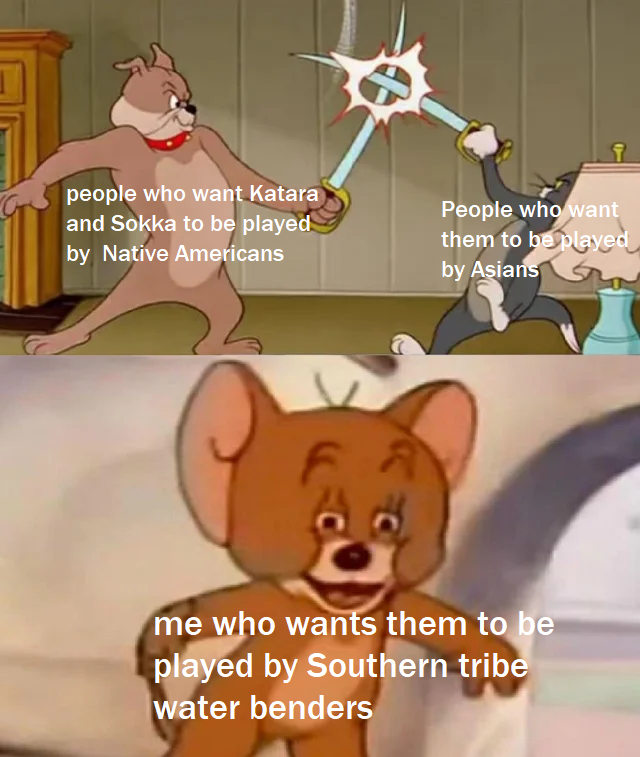
Identify the location of lamp. This screenshot has height=757, width=640. (618, 189).